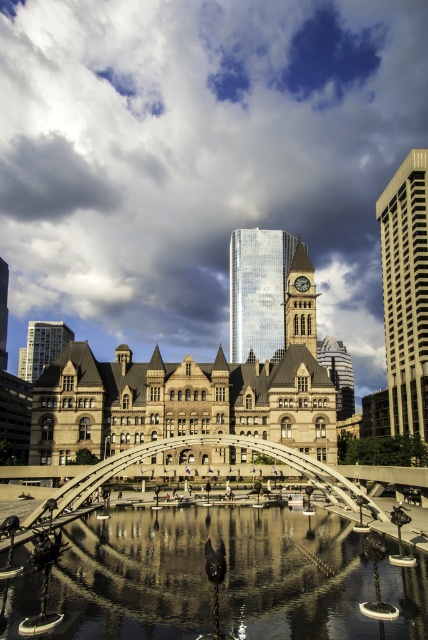
Does shiny glass tower at center have a larger size compared to brown stone clock tower at center?

Indeed, shiny glass tower at center has a larger size compared to brown stone clock tower at center.

Does point (265, 289) come in front of point (294, 330)?

No, it is not.

Which is in front, point (247, 252) or point (306, 312)?

Positioned in front is point (306, 312).

At what (x,y) coordinates should I click in order to perform the action: click on shiny glass tower at center. Please return your answer as a coordinate pair (x, y). Looking at the image, I should click on (258, 289).

Which is in front, point (160, 556) or point (65, 336)?

Point (160, 556)

Where is `reflective glass water at center`? reflective glass water at center is located at coordinates coord(220,582).

Is point (128, 536) more distant than point (38, 332)?

No, it is in front of (38, 332).

Where is `reflective glass water at center`? The image size is (428, 640). reflective glass water at center is located at coordinates (220, 582).

Which of these two, beige concrete skyscraper at right or matte glass tower at left, stands shorter?

matte glass tower at left is shorter.

Does beige concrete skyscraper at right appear on the left side of matte glass tower at left?

In fact, beige concrete skyscraper at right is to the right of matte glass tower at left.

Identify the location of beige concrete skyscraper at right. (406, 292).